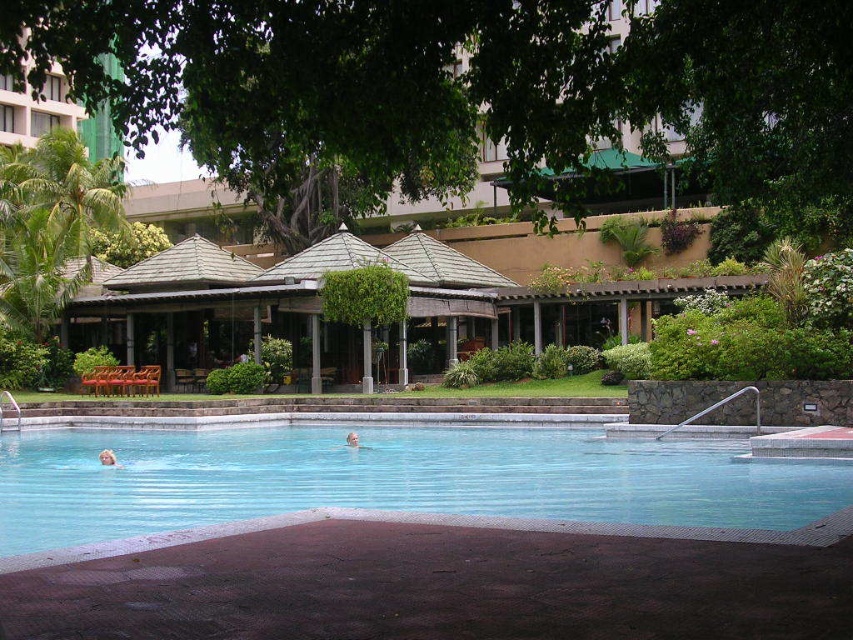
You are a photographer taking a picture of the pool area. You notice two people with light brown skin at lower center and light brown skin at center. Which person is closer to the camera?

The light brown skin at lower center is closer to the camera because it is in front of the light brown skin at center.